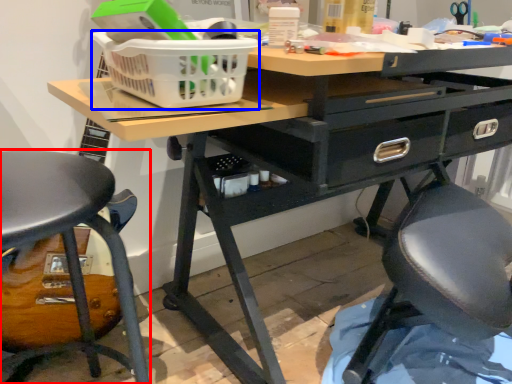
Question: Which point is closer to the camera, chair (highlighted by a red box) or basket (highlighted by a blue box)?

Choices:
 (A) chair
 (B) basket

Answer: (A)